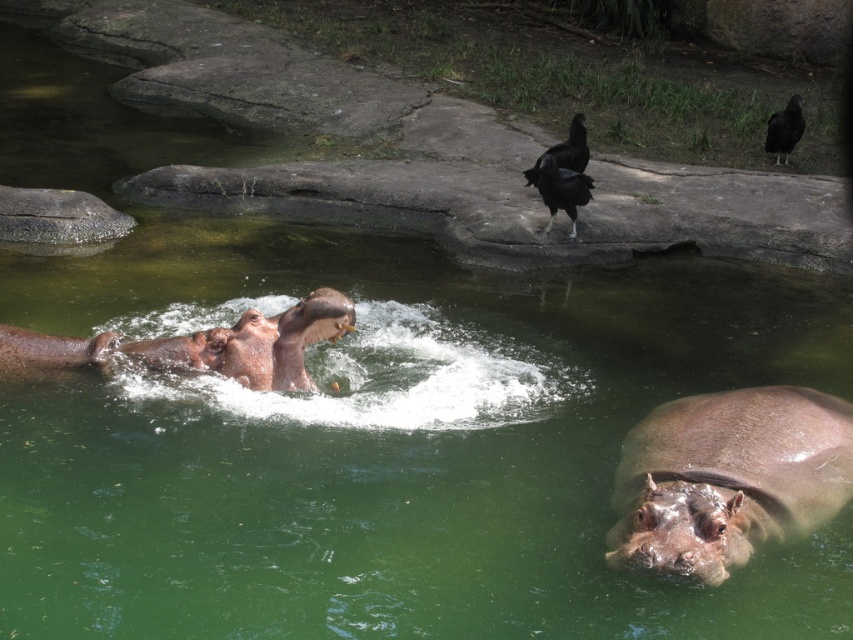
Looking at this image, you are a zookeeper observing the hippos in their enclosure. You notice two hippos at the center. Which one has its skin closer to you, the smokey brown skin at center or the brown matte hippo at center?

The smokey brown skin at center is closer to the viewer than the brown matte hippo at center.

You are a zookeeper observing the hippos in their enclosure. You need to determine the position of the brown matte hippo at center relative to the water. Is it closer to the edge of the water or the center?

The brown matte hippo at center is located at point coordinates indicating it is positioned closer to the center of the water area based on the coordinate system provided.

You are a zookeeper standing at the edge of the hippo enclosure. You notice two points marked in the water where you need to place floating food dispensers. The first point is at coordinates point (173,348) and the second is at point (799,122). Which dispenser should you place first if you want to ensure the hippos reach the food before it drifts away, considering their usual swimming paths?

You should place the dispenser at point (173,348) first because it is in front of point (799,122), meaning it is closer to the hippos and they can reach it before the food drifts away.